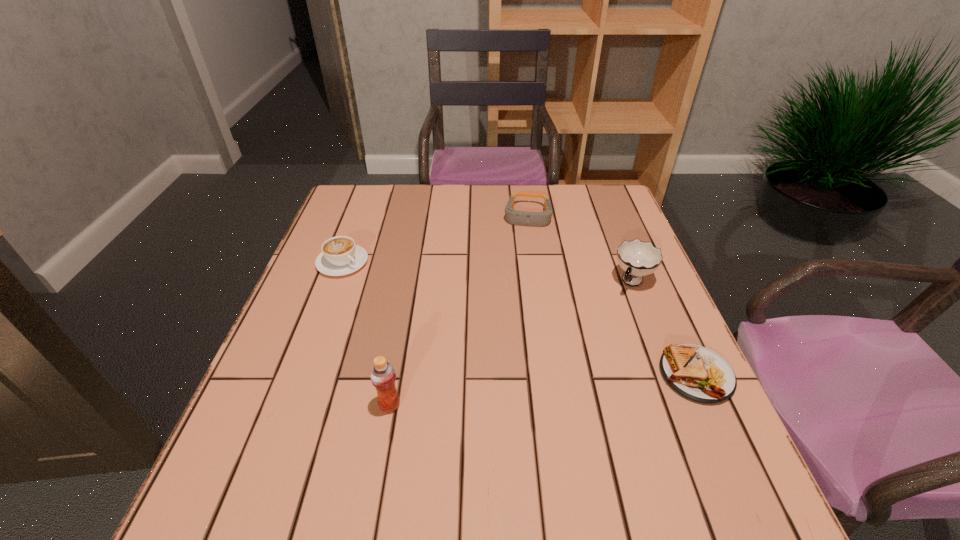
Find the location of a particular element. sandwich situated at the right edge is located at coordinates (697, 373).

What are the coordinates of `cup at the right edge` in the screenshot? It's located at (637, 258).

The width and height of the screenshot is (960, 540). What are the coordinates of `vacant space at the far edge of the desktop` in the screenshot? It's located at (498, 219).

In order to click on free location at the near edge in this screenshot , I will do `click(385, 451)`.

Image resolution: width=960 pixels, height=540 pixels. What are the coordinates of `vacant area at the left edge` in the screenshot? It's located at (338, 231).

Image resolution: width=960 pixels, height=540 pixels. I want to click on free space at the right edge of the desktop, so click(604, 229).

Identify the location of vacant space at the far left corner of the desktop. This screenshot has width=960, height=540. (348, 198).

The height and width of the screenshot is (540, 960). I want to click on free space at the near left corner of the desktop, so click(x=258, y=430).

Where is `vacant space at the far right corner of the desktop`? This screenshot has height=540, width=960. vacant space at the far right corner of the desktop is located at coordinates (616, 219).

Where is `vacant area between the shortest object and the leftmost object`? The height and width of the screenshot is (540, 960). vacant area between the shortest object and the leftmost object is located at coordinates (519, 319).